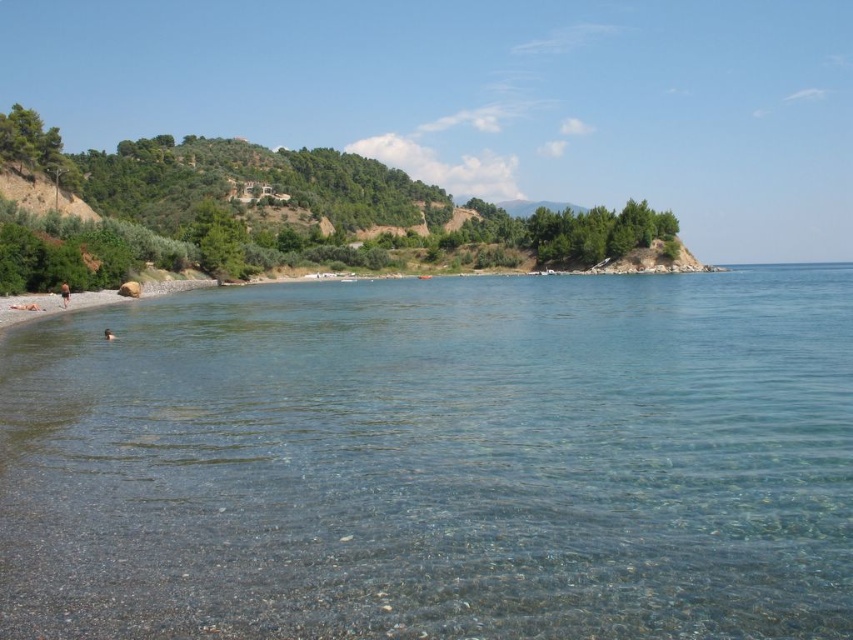
Can you confirm if clear water at lower left is positioned above brown skin at lower left?

Actually, clear water at lower left is below brown skin at lower left.

You are a GUI agent. You are given a task and a screenshot of the screen. Output one action in this format:
    pyautogui.click(x=<x>, y=<y>)
    Task: Click on the clear water at lower left
    This screenshot has height=640, width=853.
    Given the screenshot: What is the action you would take?
    pyautogui.click(x=436, y=461)

Where is `clear water at lower left`? The height and width of the screenshot is (640, 853). clear water at lower left is located at coordinates (436, 461).